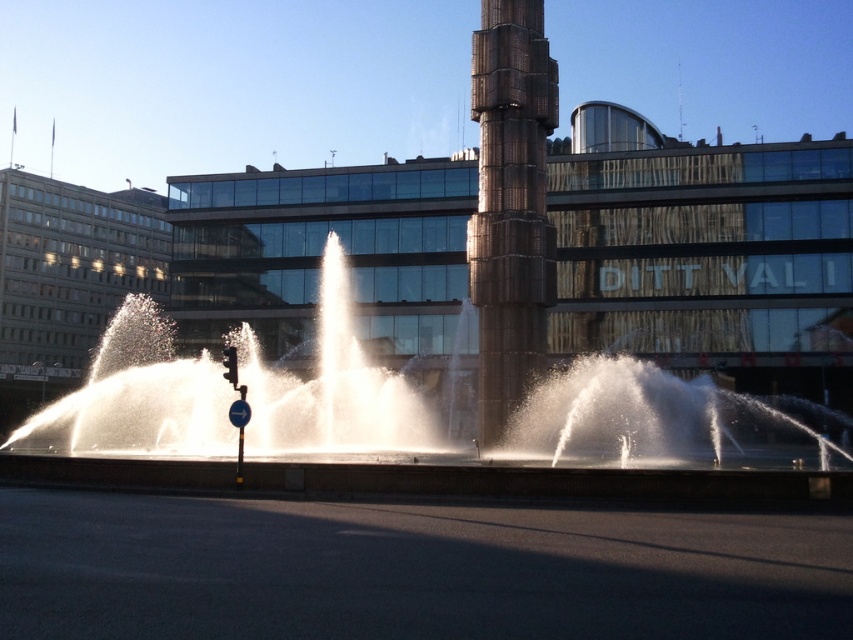
You are standing in the urban setting shown. You see a point marked at coordinates (383, 429). What object is located at that point?

The point at coordinates (383, 429) indicates white water at center.

You are standing in the urban setting and want to know which object is taller between the white water at center and the rustic metal column at center. Can you determine which one is taller?

The rustic metal column at center is taller than the white water at center.

You are a photographer planning to capture the sculpture and fountain in the image. You want to ensure that the white water at center and rustic metal column at center are both visible in your shot. Given that your camera has a fixed focal length, which object should you prioritize framing closer to the center of the photo to include both?

The white water at center is larger in size than rustic metal column at center, so you should prioritize framing the white water at center closer to the center of the photo to ensure both objects are visible while accounting for their size difference.